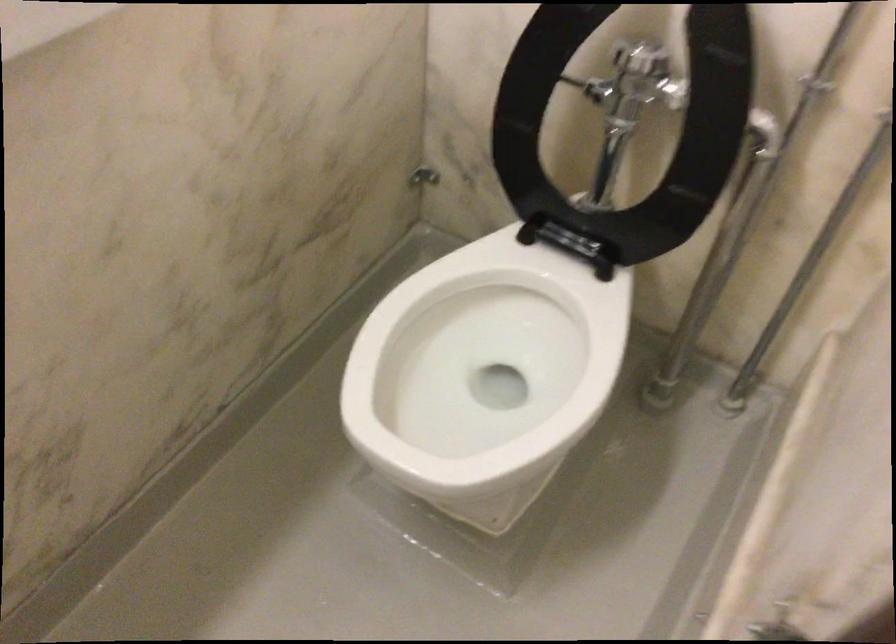
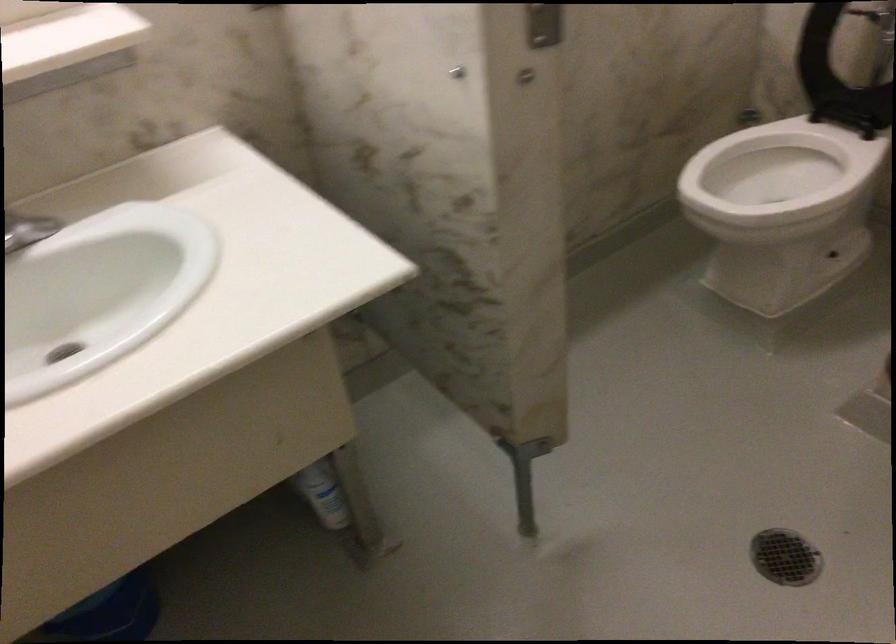
Locate, in the second image, the point that corresponds to (485,317) in the first image.

(778, 173)